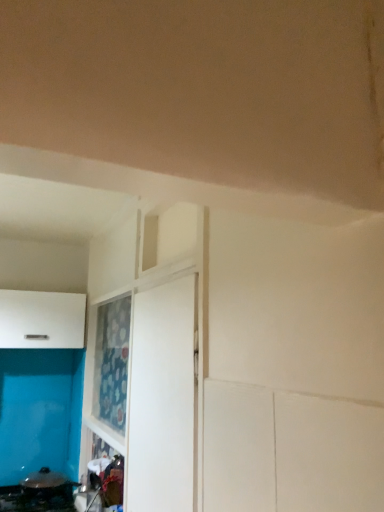
Question: Would you say white matte door at center is inside or outside black glossy pan at lower left?

Choices:
 (A) inside
 (B) outside

Answer: (B)

Question: Relative to black glossy pan at lower left, is white matte door at center in front or behind?

Choices:
 (A) behind
 (B) front

Answer: (B)

Question: Estimate the real-world distances between objects in this image. Which object is farther from the white matte door at center?

Choices:
 (A) black glossy pan at lower left
 (B) white matte cabinet at left

Answer: (A)

Question: Estimate the real-world distances between objects in this image. Which object is closer to the black glossy pan at lower left?

Choices:
 (A) white matte door at center
 (B) white matte cabinet at left

Answer: (B)